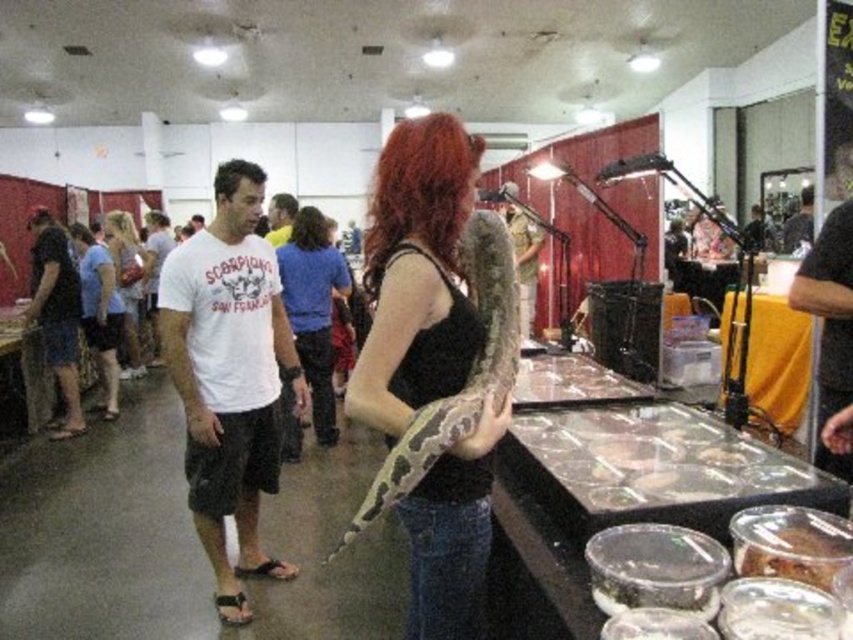
Does matte black tank top at center have a lesser width compared to matte black shirt at center?

Yes.

Describe the element at coordinates (416, 275) in the screenshot. I see `matte black tank top at center` at that location.

Locate an element on the screen. The height and width of the screenshot is (640, 853). matte black tank top at center is located at coordinates (416, 275).

Does white cotton t-shirt at center have a greater width compared to white matte shirt at center?

Yes.

Based on the photo, is white cotton t-shirt at center positioned at the back of white matte shirt at center?

No, white cotton t-shirt at center is in front of white matte shirt at center.

At what (x,y) coordinates should I click in order to perform the action: click on white cotton t-shirt at center. Please return your answer as a coordinate pair (x, y). This screenshot has height=640, width=853. Looking at the image, I should click on (229, 376).

Based on the photo, is white matte shirt at center in front of matte black shirt at center?

Yes.

This screenshot has width=853, height=640. Identify the location of white matte shirt at center. 312,308.